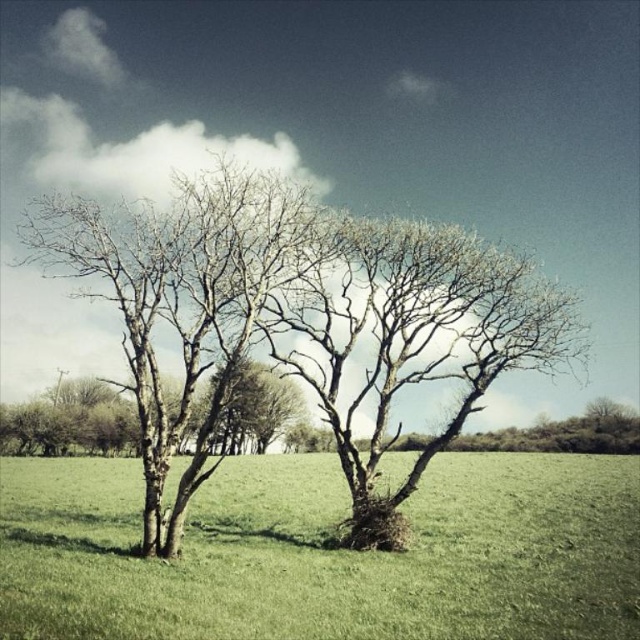
You are standing in the middle of the field looking at the two trees. There are two points marked on the image, point A at coordinates point (204, 300) and point B at coordinates point (365, 301). Which point is closer to you?

Point A at coordinates point (204, 300) is closer to the viewer than point B at coordinates point (365, 301).

You are a bird looking for a place to perch. You see the bare bark tree at center and the bare branches at center. Which one is closer to the left side of the image?

The bare bark tree at center is to the left of the bare branches at center, so it is closer to the left side of the image.

You are standing at the origin point of the image coordinate system. You want to walk to the green grass at center. Which direction should you move? Please answer with coordinates in the format of a tuple, like this example format, e.g., 0.866, 0.509. Do not add any other words or explanations.

The green grass at center is located at coordinates (324, 554). Since you are at the origin point, you should move towards those coordinates. The answer is (324, 554).